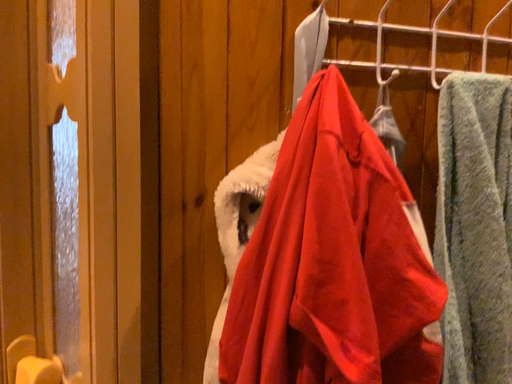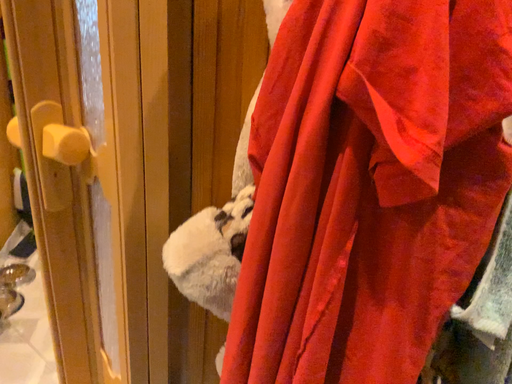
Question: Which way did the camera rotate in the video?

Choices:
 (A) rotated upward
 (B) rotated downward

Answer: (B)